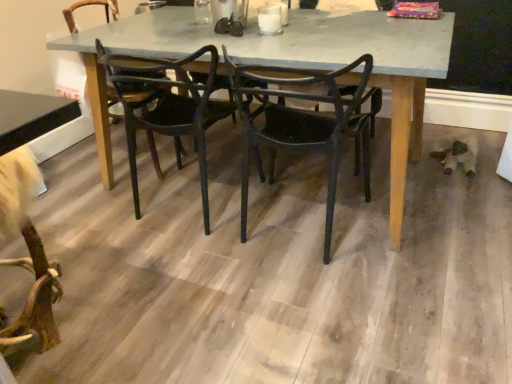
You are a GUI agent. You are given a task and a screenshot of the screen. Output one action in this format:
    pyautogui.click(x=<x>, y=<y>)
    Task: Click on the free space to the right of black matte chair at center, the first chair from the right
    The height and width of the screenshot is (384, 512).
    Given the screenshot: What is the action you would take?
    pyautogui.click(x=420, y=223)